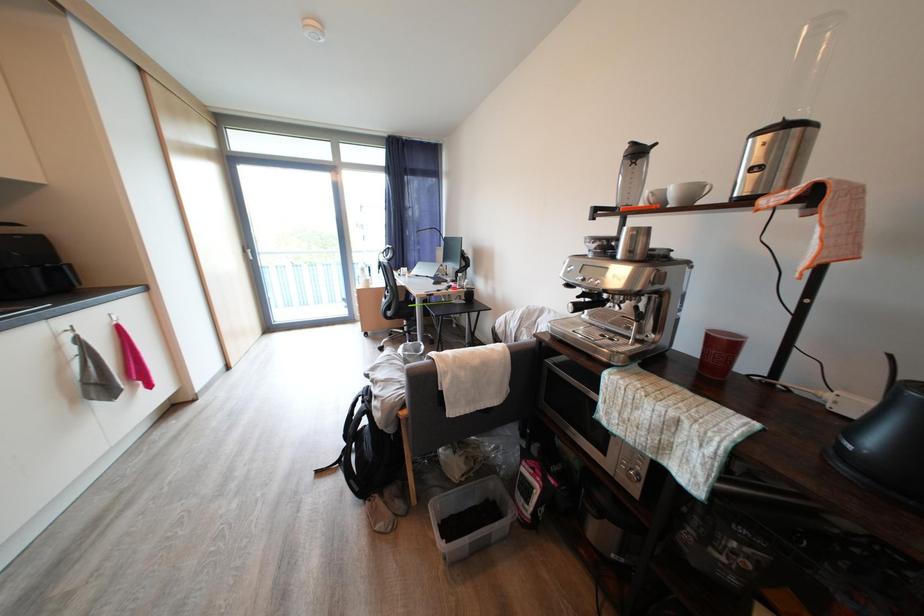
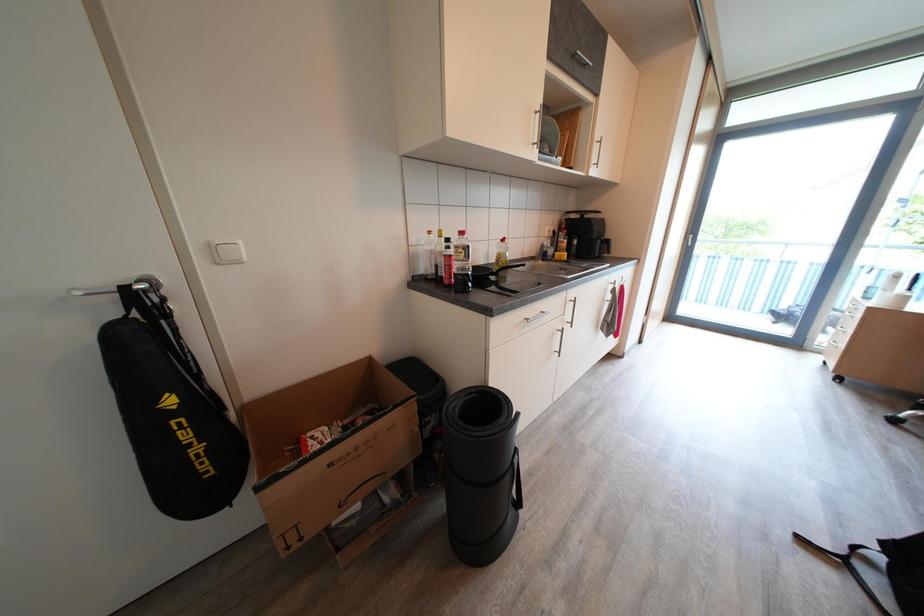
Question: The camera is either moving clockwise (left) or counter-clockwise (right) around the object. The first image is from the beginning of the video and the second image is from the end. Is the camera moving left or right when shooting the video?

Choices:
 (A) Left
 (B) Right

Answer: (B)